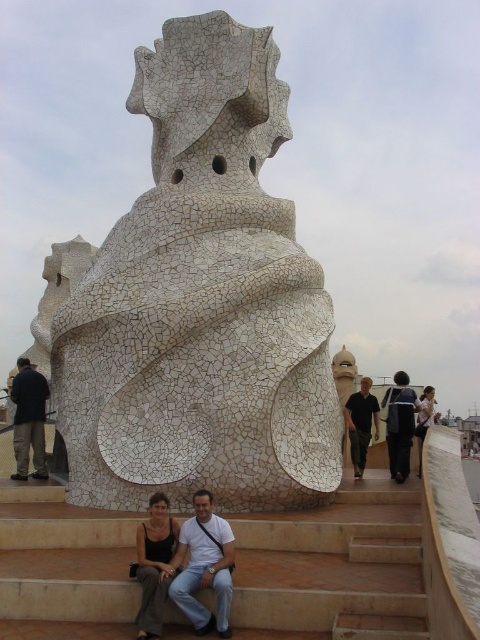
Question: Can you confirm if matte black tank top at lower center is positioned below matte white statue at center?

Choices:
 (A) no
 (B) yes

Answer: (B)

Question: Which point is closer to the camera?

Choices:
 (A) brown stone stairs at lower center
 (B) dark brown leather jacket at left
 (C) matte black tank top at lower center

Answer: (A)

Question: Which point is farther to the camera?

Choices:
 (A) dark brown leather jacket at left
 (B) matte white dress at right
 (C) light brown leather pants at lower center
 (D) matte black tank top at lower center

Answer: (A)

Question: Is dark blue jeans at center to the right of matte white dress at right from the viewer's perspective?

Choices:
 (A) no
 (B) yes

Answer: (A)

Question: Is brown stone stairs at lower center bigger than matte white dress at right?

Choices:
 (A) no
 (B) yes

Answer: (A)

Question: Which of the following is the farthest from the observer?

Choices:
 (A) matte white dress at right
 (B) light brown leather pants at lower center
 (C) matte white statue at center
 (D) dark blue jeans at center

Answer: (C)